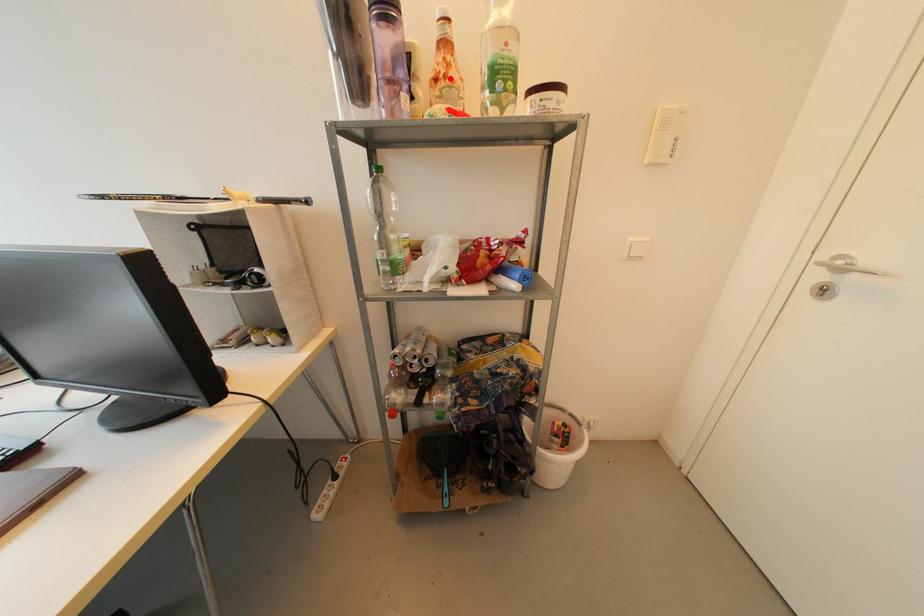
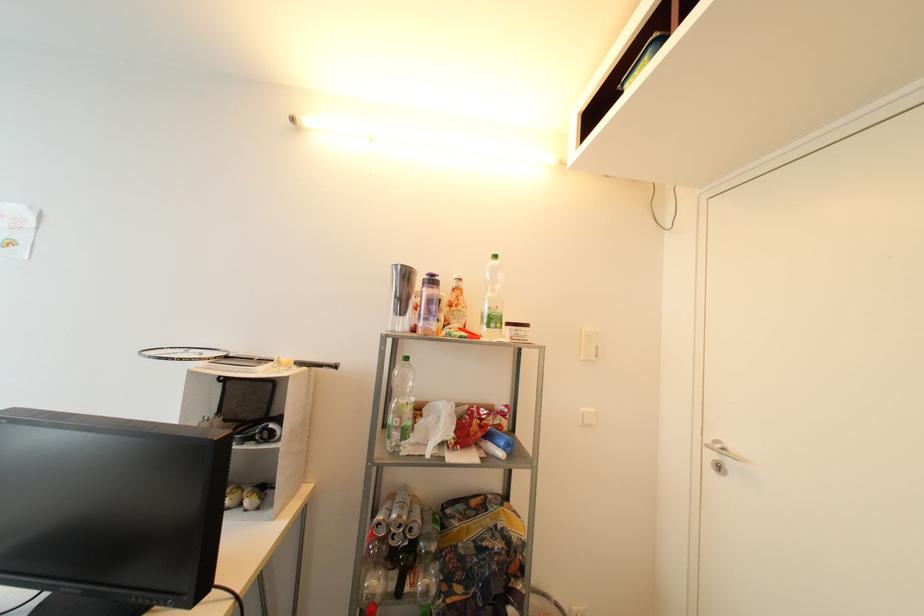
The point at the highlighted location is marked in the first image. Where is the corresponding point in the second image?

(462, 307)